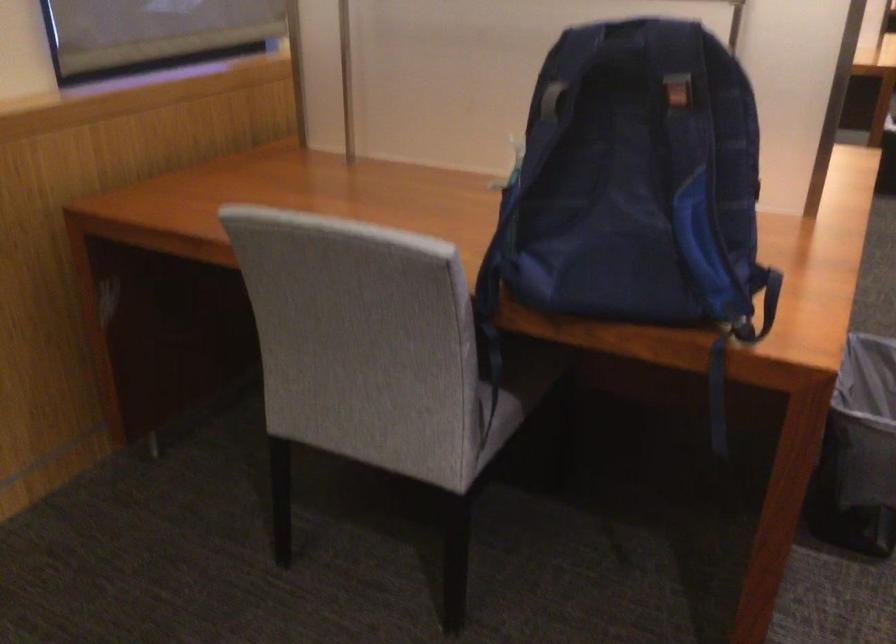
Identify the location of backpack handle. (552, 100).